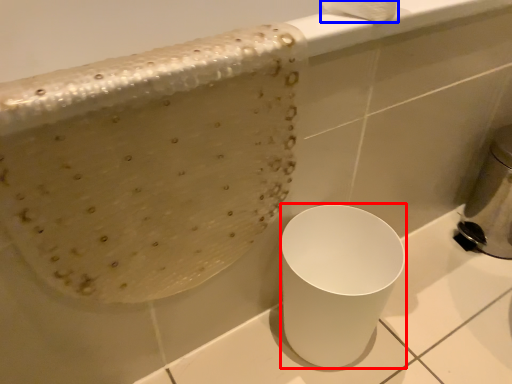
Question: Among these objects, which one is farthest to the camera, porcelain (highlighted by a red box) or toilet paper (highlighted by a blue box)?

Choices:
 (A) porcelain
 (B) toilet paper

Answer: (A)